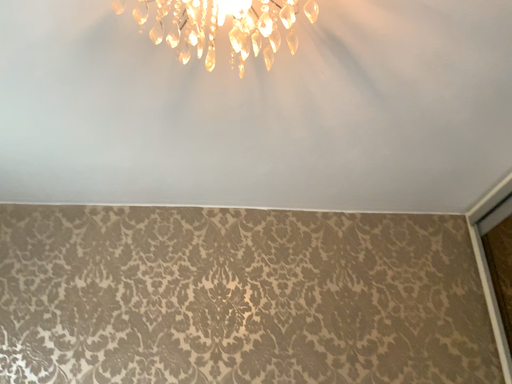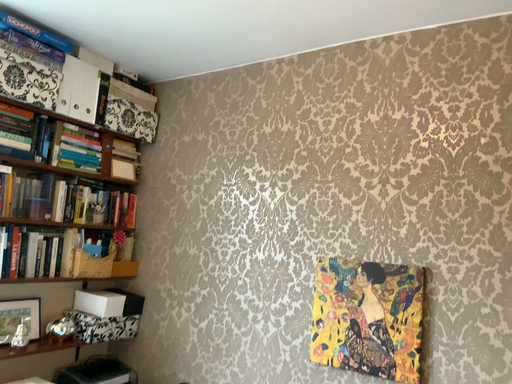
Question: Which way did the camera rotate in the video?

Choices:
 (A) rotated upward
 (B) rotated downward

Answer: (B)